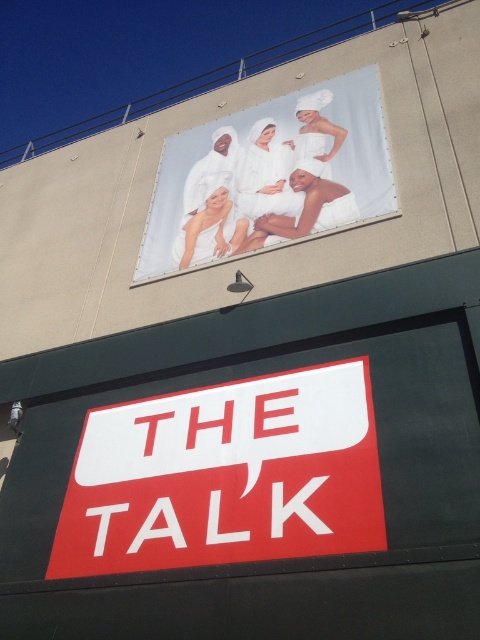
Is white matte sign at center below white towel at upper center?

Indeed, white matte sign at center is positioned under white towel at upper center.

Can you confirm if white matte sign at center is smaller than white towel at upper center?

Yes.

Who is more distant from viewer, [197,541] or [264,132]?

The point [264,132] is behind.

Where is `white matte sign at center`? The image size is (480, 640). white matte sign at center is located at coordinates (226, 476).